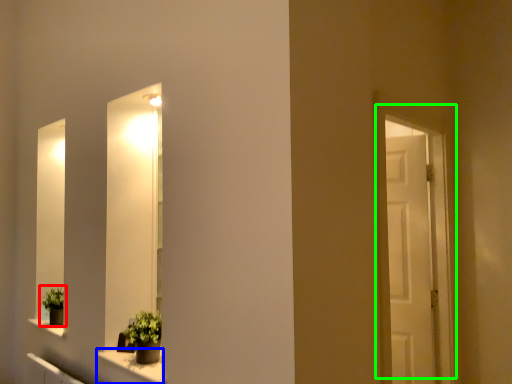
Question: Based on their relative distances, which object is farther from houseplant (highlighted by a red box)? Choose from window sill (highlighted by a blue box) and door (highlighted by a green box).

Choices:
 (A) window sill
 (B) door

Answer: (B)